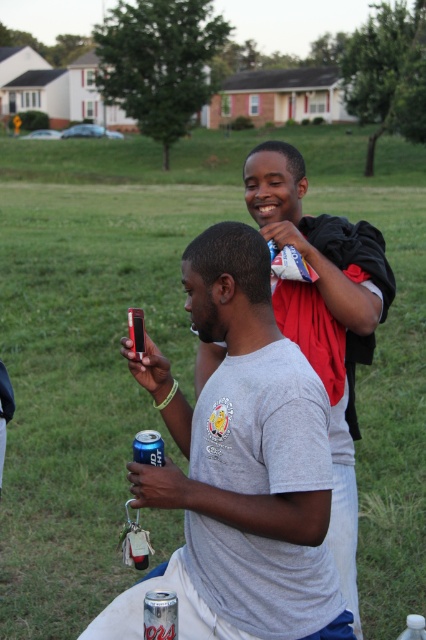
Question: Which of these objects is positioned closest to the silver metallic can at lower center?

Choices:
 (A) matte black phone at center
 (B) clear plastic bottle at center

Answer: (A)

Question: Which object is closer to the camera taking this photo?

Choices:
 (A) matte black phone at center
 (B) clear plastic bottle at center

Answer: (A)

Question: Does matte black phone at center have a lesser width compared to matte black jacket at upper right?

Choices:
 (A) yes
 (B) no

Answer: (B)

Question: Which point is closer to the camera?

Choices:
 (A) (408, 618)
 (B) (331, 312)

Answer: (A)

Question: Is matte black phone at center bigger than blue metallic can at lower center?

Choices:
 (A) no
 (B) yes

Answer: (B)

Question: Does blue metallic can at lower center appear on the left side of clear plastic bottle at center?

Choices:
 (A) yes
 (B) no

Answer: (A)